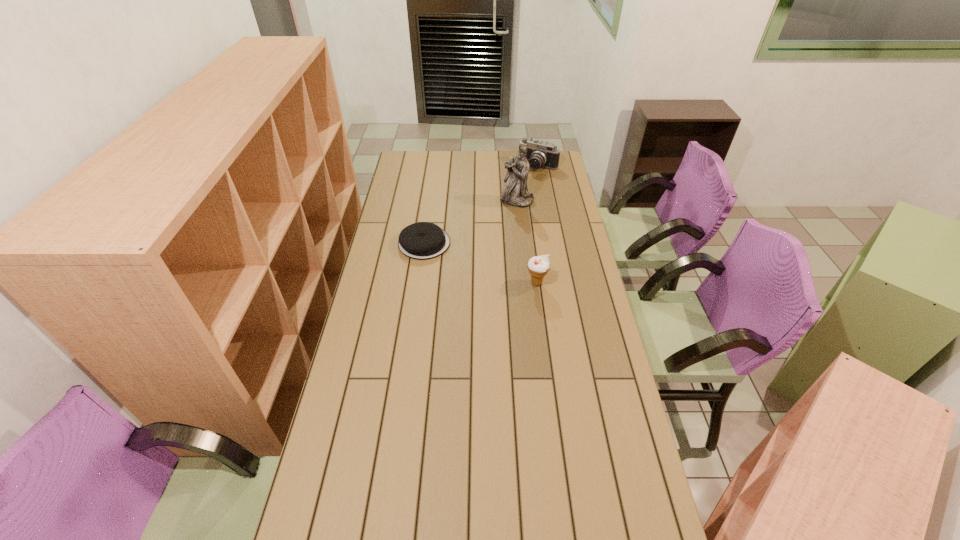
Identify the location of the third farthest object. This screenshot has width=960, height=540. (423, 240).

At what (x,y) coordinates should I click in order to perform the action: click on the leftmost object. Please return your answer as a coordinate pair (x, y). This screenshot has width=960, height=540. Looking at the image, I should click on (423, 240).

The image size is (960, 540). I want to click on the nearest object, so click(x=538, y=266).

You are a GUI agent. You are given a task and a screenshot of the screen. Output one action in this format:
    pyautogui.click(x=<x>, y=<y>)
    Task: Click on the third nearest object
    Image resolution: width=960 pixels, height=540 pixels.
    Given the screenshot: What is the action you would take?
    pyautogui.click(x=514, y=193)

Where is `figurine`? The width and height of the screenshot is (960, 540). figurine is located at coordinates (514, 193).

Where is `the farthest object`? Image resolution: width=960 pixels, height=540 pixels. the farthest object is located at coordinates (539, 154).

Where is `free spot located on the back of the shortest object`? This screenshot has height=540, width=960. free spot located on the back of the shortest object is located at coordinates (429, 208).

At what (x,y) coordinates should I click in order to perform the action: click on free spot located on the left of the icecream. Please return your answer as a coordinate pair (x, y). The image size is (960, 540). Looking at the image, I should click on (469, 283).

The image size is (960, 540). Find the location of `vacant space located 0.190m on the front-facing side of the tallest object`. vacant space located 0.190m on the front-facing side of the tallest object is located at coordinates (496, 230).

Find the location of a particular element. This screenshot has width=960, height=540. free space located on the front-facing side of the tallest object is located at coordinates (500, 224).